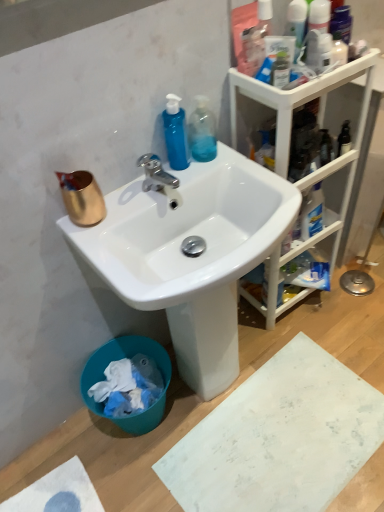
Question: Considering the positions of white plastic cabinet at upper right and teal plastic trash bin at lower left in the image, is white plastic cabinet at upper right taller or shorter than teal plastic trash bin at lower left?

Choices:
 (A) short
 (B) tall

Answer: (B)

Question: Relative to teal plastic trash bin at lower left, is white plastic cabinet at upper right in front or behind?

Choices:
 (A) behind
 (B) front

Answer: (B)

Question: Estimate the real-world distances between objects in this image. Which object is closer to the white glossy sink at center?

Choices:
 (A) translucent plastic bottle at upper right
 (B) transparent plastic bottle at upper center, placed as the 1th cleaning product when sorted from right to left
 (C) teal plastic trash bin at lower left
 (D) copper metallic cup at upper left
 (E) white matte cardboard at lower right

Answer: (D)

Question: Based on their relative distances, which object is farther from the white plastic cabinet at upper right?

Choices:
 (A) white matte cardboard at lower right
 (B) teal plastic trash bin at lower left
 (C) blue translucent bottle at upper center, positioned as the 2th cleaning product in right-to-left order
 (D) chrome metallic faucet at upper center
 (E) translucent plastic bottle at upper right

Answer: (B)